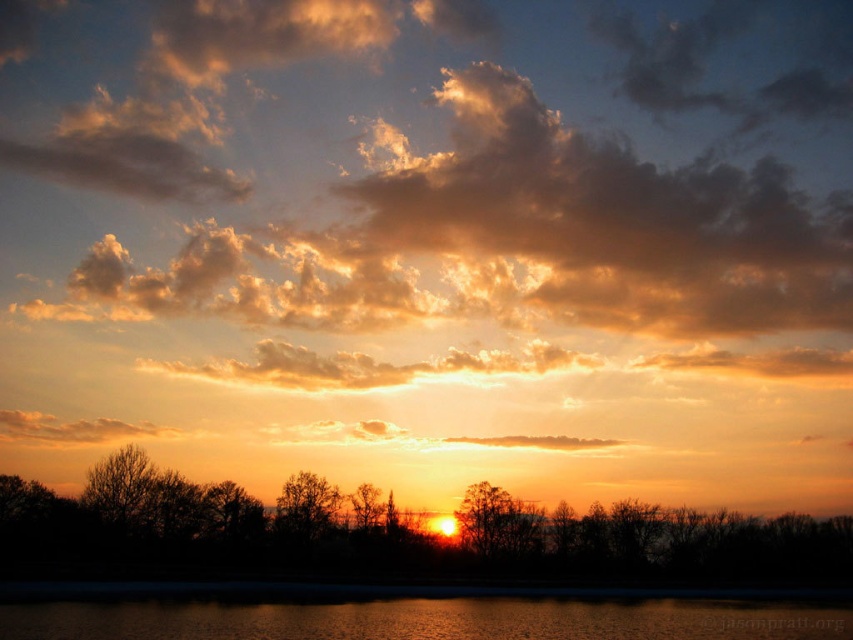
Question: Among these points, which one is nearest to the camera?

Choices:
 (A) click(x=173, y=621)
 (B) click(x=527, y=189)
 (C) click(x=0, y=493)
 (D) click(x=297, y=506)

Answer: (A)

Question: Does brown matte tree at center appear over brown textured tree at center?

Choices:
 (A) no
 (B) yes

Answer: (A)

Question: Which is farther from the silhouette tree at center?

Choices:
 (A) glistening water at lower center
 (B) brown textured tree at center
 (C) brown matte tree at center

Answer: (A)

Question: Does silhouette tree at center have a greater width compared to brown matte tree at center?

Choices:
 (A) no
 (B) yes

Answer: (B)

Question: Which object appears farthest from the camera in this image?

Choices:
 (A) glistening water at lower center
 (B) brown matte tree at center
 (C) golden fluffy cloud at upper center

Answer: (C)

Question: Is golden fluffy cloud at upper center below brown matte tree at center?

Choices:
 (A) no
 (B) yes

Answer: (A)